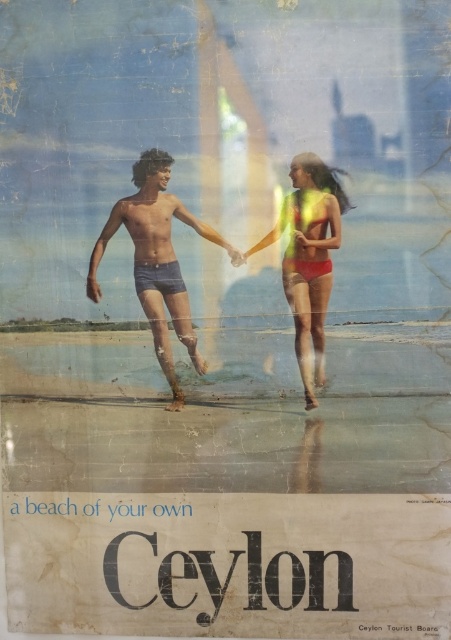
You are designing a new travel poster and want to ensure that the blue denim shorts at center and the matte yellow bikini at center are proportionate to each other. Based on the original poster, which item should you make larger in your design?

The blue denim shorts at center should be made larger than the matte yellow bikini at center to maintain proportionality as per the original poster.

Please look at the vintage travel poster for Ceylon. There is a point at coordinates (x=157, y=260). The poster shows two people on a beach. The man is wearing blue denim shorts, and the woman is in a bright red bikini. Can you determine which object the point is located on?

The point at coordinates (x=157, y=260) is on the blue denim shorts at center.